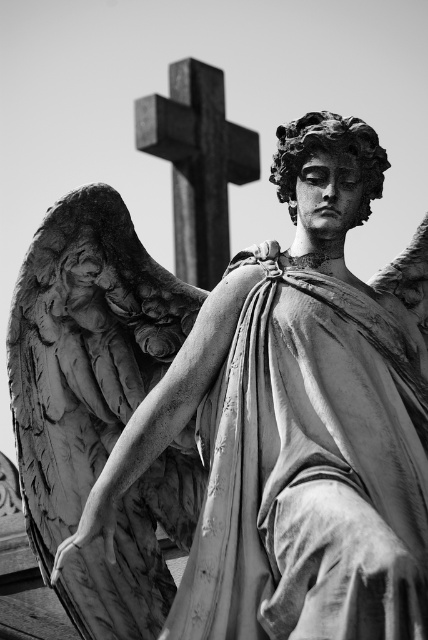
Who is shorter, smooth stone angel at center or smooth stone cross at upper center?

Standing shorter between the two is smooth stone cross at upper center.

What do you see at coordinates (297, 422) in the screenshot? The image size is (428, 640). I see `smooth stone angel at center` at bounding box center [297, 422].

Locate an element on the screen. This screenshot has width=428, height=640. smooth stone angel at center is located at coordinates (297, 422).

Does point (119, 492) come closer to viewer compared to point (41, 278)?

Yes.

Between point (422, 288) and point (104, 630), which one is positioned behind?

The point (422, 288) is more distant.

At what (x,y) coordinates should I click in order to perform the action: click on smooth stone angel at center. Please return your answer as a coordinate pair (x, y). Looking at the image, I should click on (297, 422).

The width and height of the screenshot is (428, 640). What do you see at coordinates (83, 353) in the screenshot?
I see `smooth stone angel wings at left` at bounding box center [83, 353].

Is smooth stone angel wings at left thinner than smooth stone cross at upper center?

In fact, smooth stone angel wings at left might be wider than smooth stone cross at upper center.

At what (x,y) coordinates should I click in order to perform the action: click on smooth stone angel wings at left. Please return your answer as a coordinate pair (x, y). The width and height of the screenshot is (428, 640). Looking at the image, I should click on (83, 353).

Locate an element on the screen. The height and width of the screenshot is (640, 428). smooth stone angel wings at left is located at coordinates (83, 353).